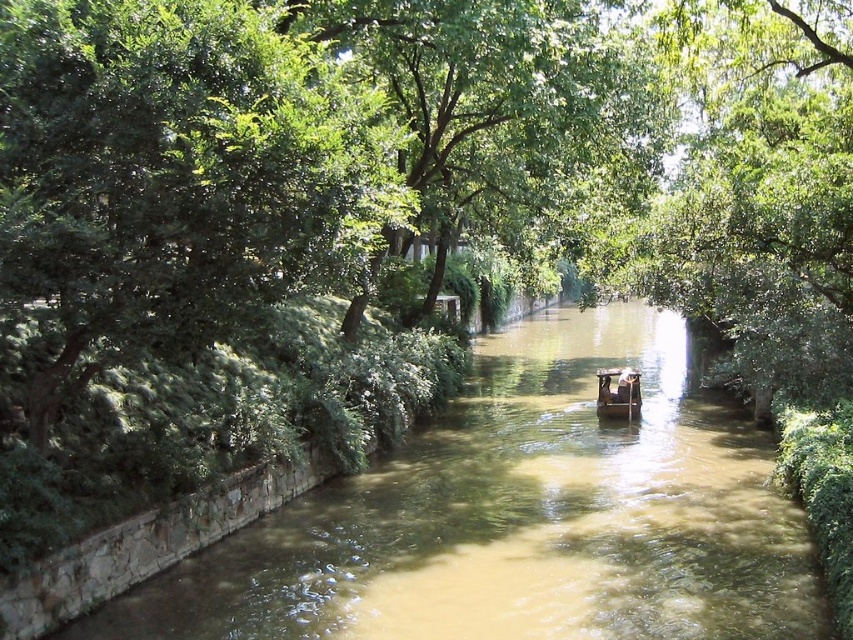
Question: Which point is closer to the camera taking this photo?

Choices:
 (A) (614, 371)
 (B) (619, 353)

Answer: (A)

Question: Which object is the farthest from the brown muddy water at center?

Choices:
 (A) green leafy tree at center
 (B) wooden boat at center

Answer: (B)

Question: Is brown muddy water at center positioned behind wooden boat at center?

Choices:
 (A) no
 (B) yes

Answer: (A)

Question: Which point is closer to the camera?

Choices:
 (A) (424, 93)
 (B) (312, 74)
 (C) (380, 508)

Answer: (B)

Question: Can you confirm if green leafy tree at center is wider than wooden boat at center?

Choices:
 (A) yes
 (B) no

Answer: (A)

Question: Does green leafy tree at left lie behind green leafy tree at center?

Choices:
 (A) yes
 (B) no

Answer: (B)